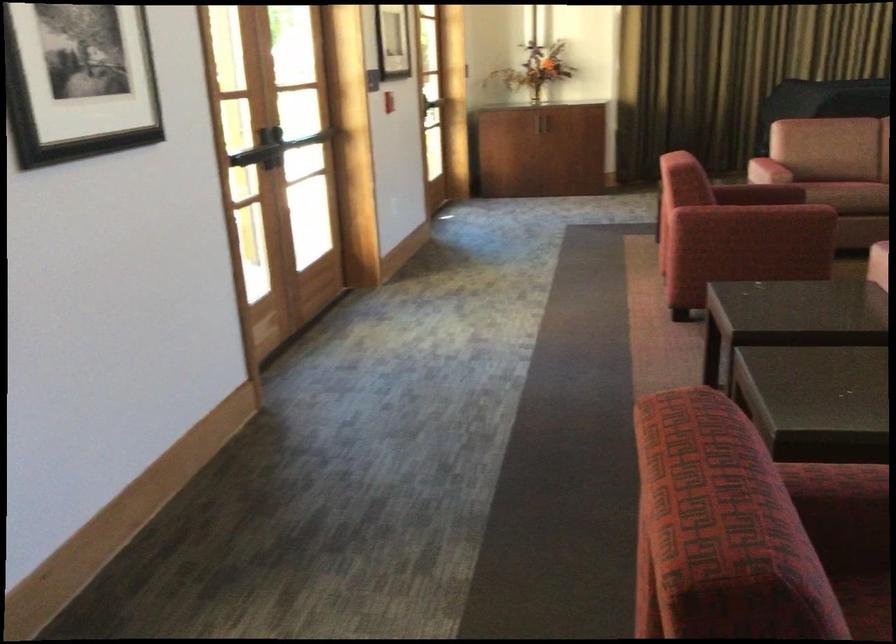
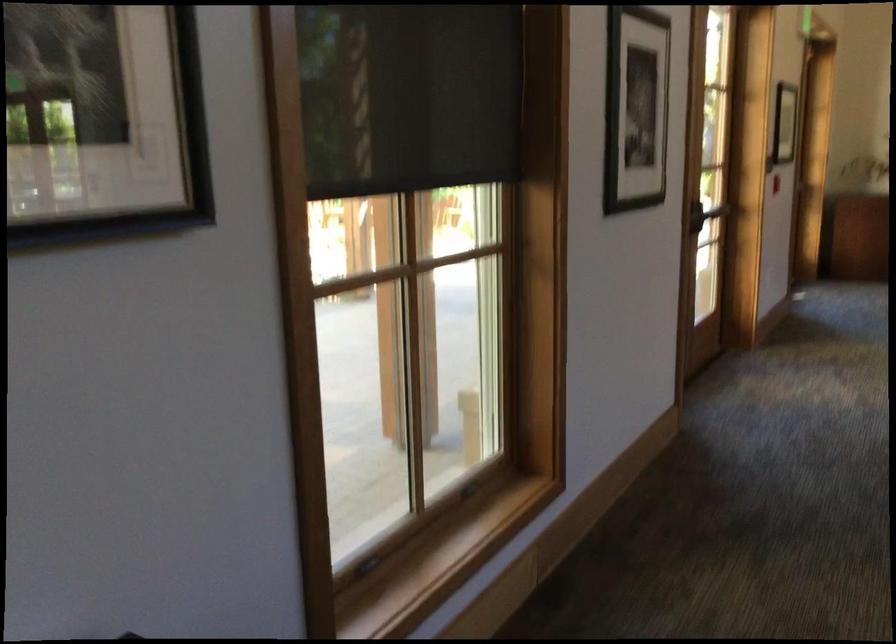
What movement of the cameraman would produce the second image?

The cameraman moved toward left, backward.